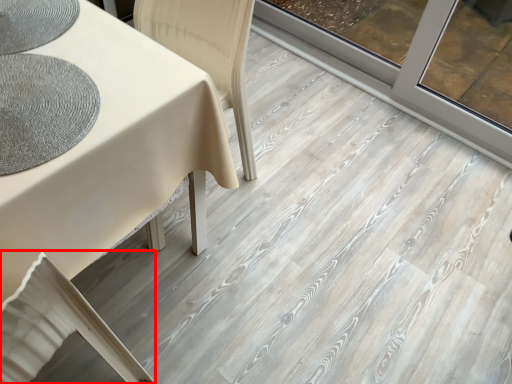
Question: From the image's perspective, where is swivel chair (annotated by the red box) located relative to mat?

Choices:
 (A) below
 (B) above

Answer: (A)